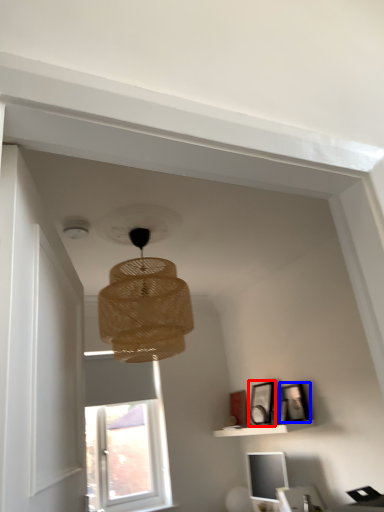
Question: Among these objects, which one is nearest to the camera, picture frame (highlighted by a red box) or picture frame (highlighted by a blue box)?

Choices:
 (A) picture frame
 (B) picture frame

Answer: (B)